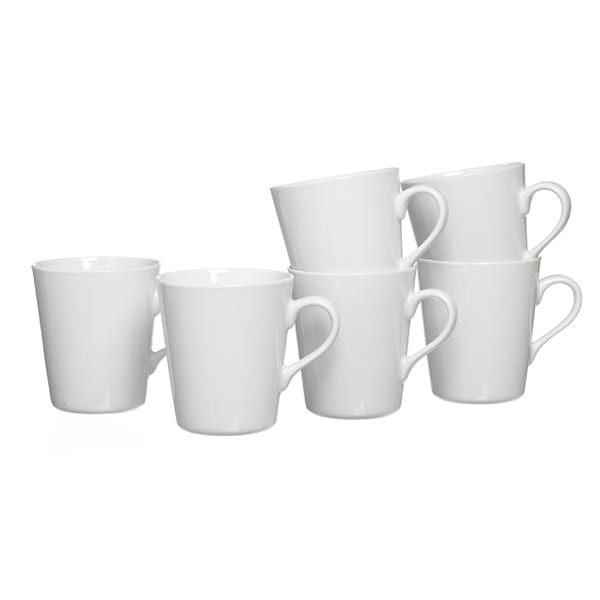
Identify the location of handles of the cups. (159, 358), (303, 359), (433, 236), (418, 352), (546, 244), (535, 348).